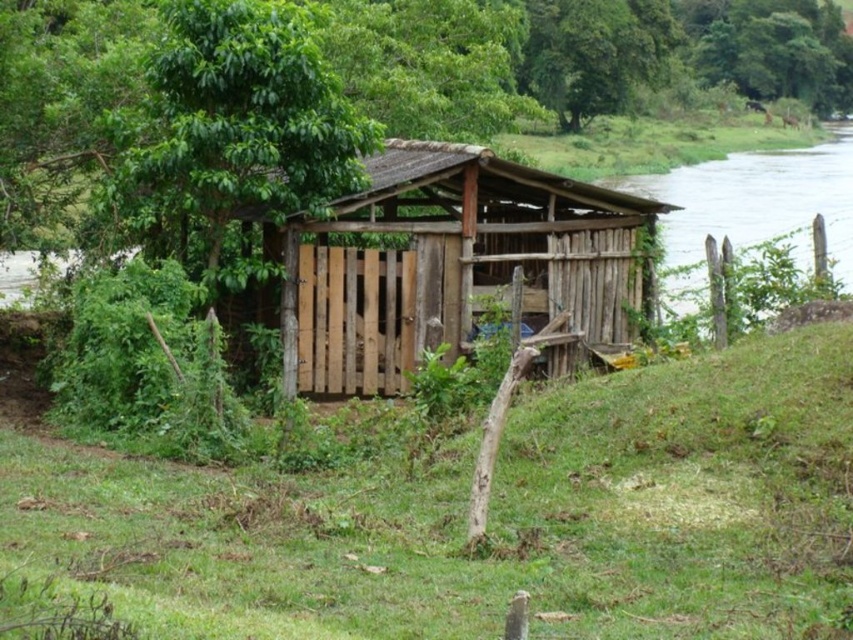
You are standing on the green grassy at center and want to enter the wooden shack at center. Which direction should you move to reach the shack?

The wooden shack at center is taller than the green grassy at center, so you should move towards the wooden shack at center to enter it.